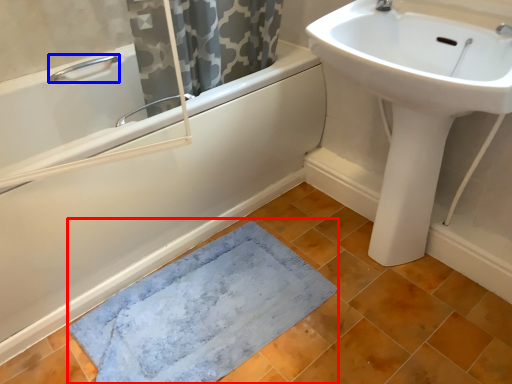
Question: Which object is closer to the camera taking this photo, bath mat (highlighted by a red box) or plumbing fixture (highlighted by a blue box)?

Choices:
 (A) bath mat
 (B) plumbing fixture

Answer: (A)